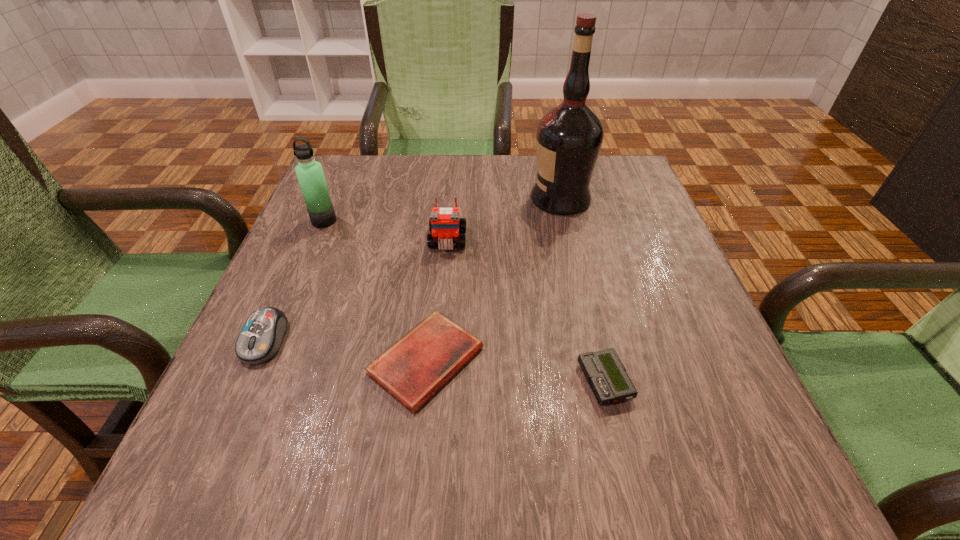
Where is `the tallest object`? The height and width of the screenshot is (540, 960). the tallest object is located at coordinates (569, 137).

Locate an element on the screen. The height and width of the screenshot is (540, 960). the fifth shortest object is located at coordinates (309, 172).

What are the coordinates of `Lego` in the screenshot? It's located at (446, 227).

This screenshot has height=540, width=960. What are the coordinates of `computer mouse` in the screenshot? It's located at (261, 337).

You are a GUI agent. You are given a task and a screenshot of the screen. Output one action in this format:
    pyautogui.click(x=<x>, y=<y>)
    Task: Click on the beeper
    
    Given the screenshot: What is the action you would take?
    pyautogui.click(x=606, y=375)

Image resolution: width=960 pixels, height=540 pixels. In order to click on diary in this screenshot , I will do `click(414, 368)`.

Where is `vacant space located on the surface of the tallest object`? This screenshot has width=960, height=540. vacant space located on the surface of the tallest object is located at coordinates (453, 199).

In order to click on blank area located on the surface of the tallest object in this screenshot , I will do `click(369, 199)`.

Find the location of a particular element. vacant region located on the surface of the tallest object is located at coordinates (400, 199).

Locate an element on the screen. The height and width of the screenshot is (540, 960). free space located on the back of the second tallest object is located at coordinates (348, 163).